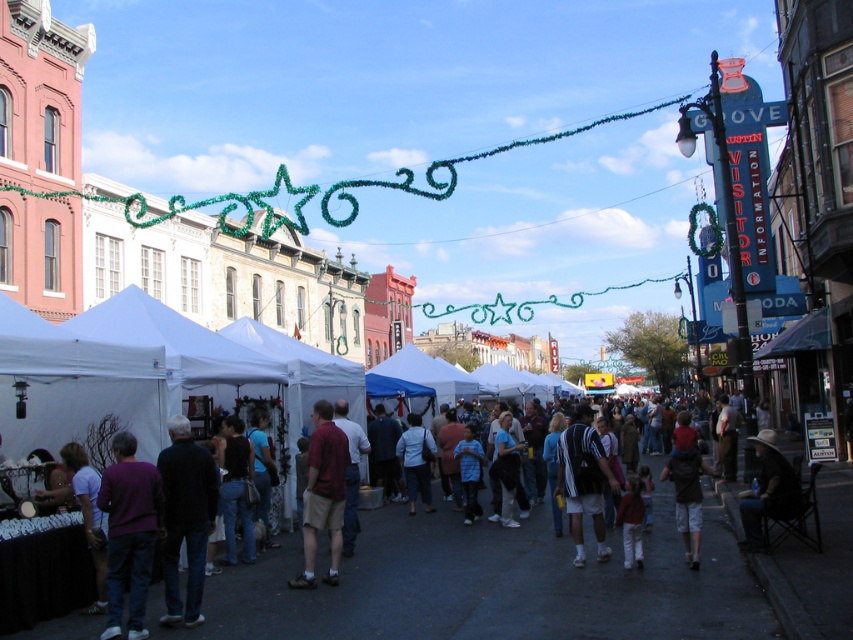
You are a customer at the market and want to buy both the denim jacket at lower right and the blue cotton shirt at center. However, you have a limited budget and can only choose one. Based on their positions in the image, which item is more accessible to you for closer inspection?

The denim jacket at lower right is closer to the viewer than the blue cotton shirt at center, so it is more accessible for closer inspection.

You are a vendor at the market and need to decide which clothing item to display first. The denim jacket at lower right and the white matte shirt at center are both on your stall. Which item takes up more space on your display rack?

The denim jacket at lower right has a larger size compared to the white matte shirt at center, so it takes up more space on the display rack.

You are a photographer planning to take a photo of the denim jeans at center and the blue cotton shirt at center in the market scene. Based on their positions, which object should you focus on first to ensure both are in the frame without moving the camera?

The denim jeans at center is wider than the blue cotton shirt at center, so you should focus on the denim jeans at center first to ensure both fit within the camera frame.